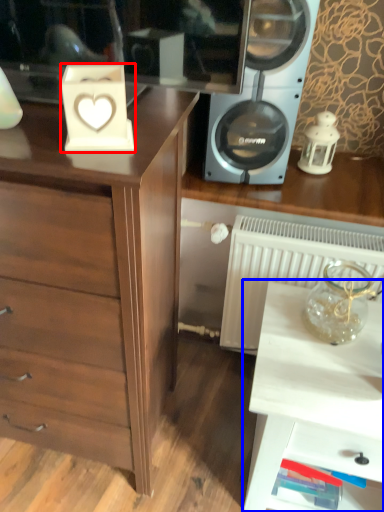
Question: Among these objects, which one is nearest to the camera, appliance (highlighted by a red box) or table (highlighted by a blue box)?

Choices:
 (A) appliance
 (B) table

Answer: (A)